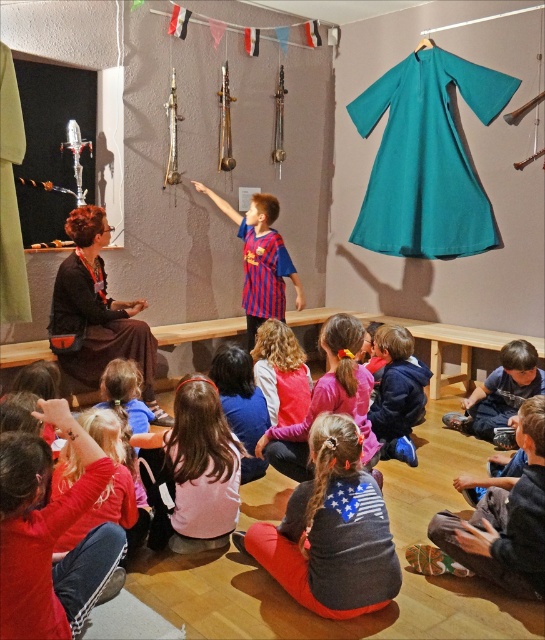
Does point (94, 365) come farther from viewer compared to point (482, 413)?

No, (94, 365) is closer to viewer.

Is matte brown dress at left in front of blue cotton shirt at lower right?

No.

Where is `matte brown dress at left`? The image size is (545, 640). matte brown dress at left is located at coordinates (99, 310).

Which of these two, matte teal fabric dress at upper center or striped jersey at center, stands taller?

matte teal fabric dress at upper center is taller.

Is matte teal fabric dress at upper center to the left of striped jersey at center from the viewer's perspective?

In fact, matte teal fabric dress at upper center is to the right of striped jersey at center.

Does point (395, 86) come in front of point (243, 285)?

No, (395, 86) is further to viewer.

Locate an element on the screen. Image resolution: width=545 pixels, height=640 pixels. matte teal fabric dress at upper center is located at coordinates (426, 157).

Is point (508, 81) closer to viewer compared to point (486, 378)?

No, it is not.

Consider the image. Can you confirm if matte teal fabric dress at upper center is smaller than blue cotton shirt at lower right?

Actually, matte teal fabric dress at upper center might be larger than blue cotton shirt at lower right.

Does point (500, 83) come in front of point (487, 440)?

No, (500, 83) is further to viewer.

I want to click on matte teal fabric dress at upper center, so click(x=426, y=157).